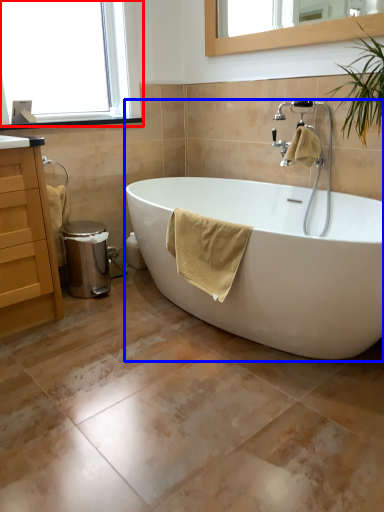
Question: Among these objects, which one is farthest to the camera, window (highlighted by a red box) or bathtub (highlighted by a blue box)?

Choices:
 (A) window
 (B) bathtub

Answer: (A)